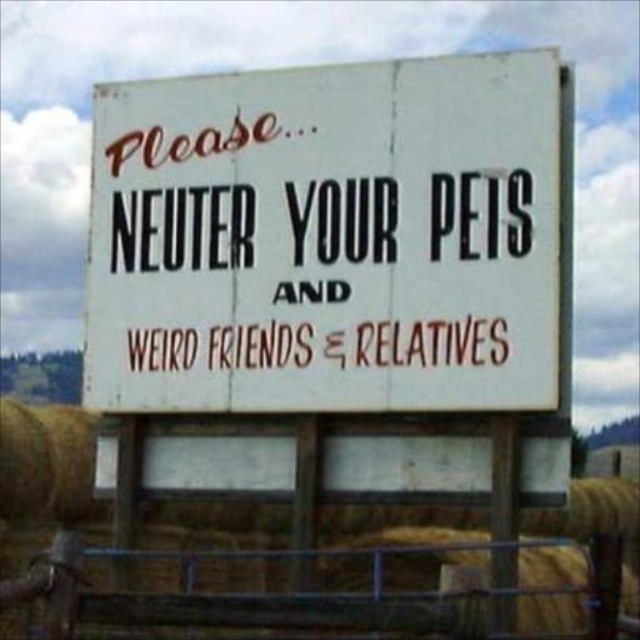
Describe the element at coordinates (326, 237) in the screenshot. I see `white paper sign at center` at that location.

Who is higher up, white paper sign at center or metal wire fence at lower center?

white paper sign at center is above.

Who is more forward, (x=520, y=305) or (x=147, y=627)?

Point (x=520, y=305) is more forward.

Find the location of a particular element. white paper sign at center is located at coordinates (326, 237).